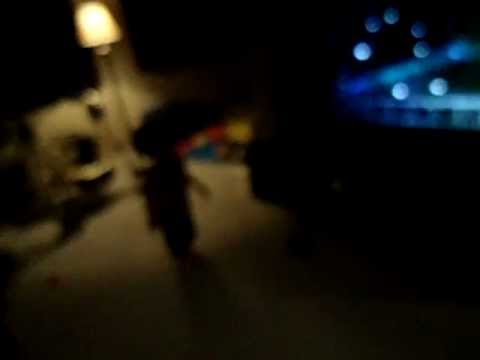
Where is `floor`? Image resolution: width=480 pixels, height=360 pixels. floor is located at coordinates [116, 251].